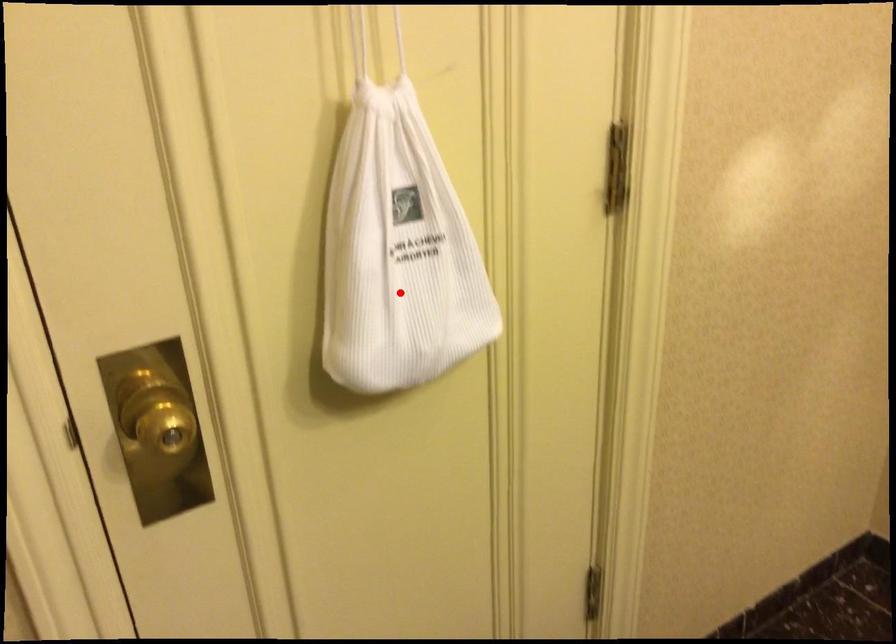
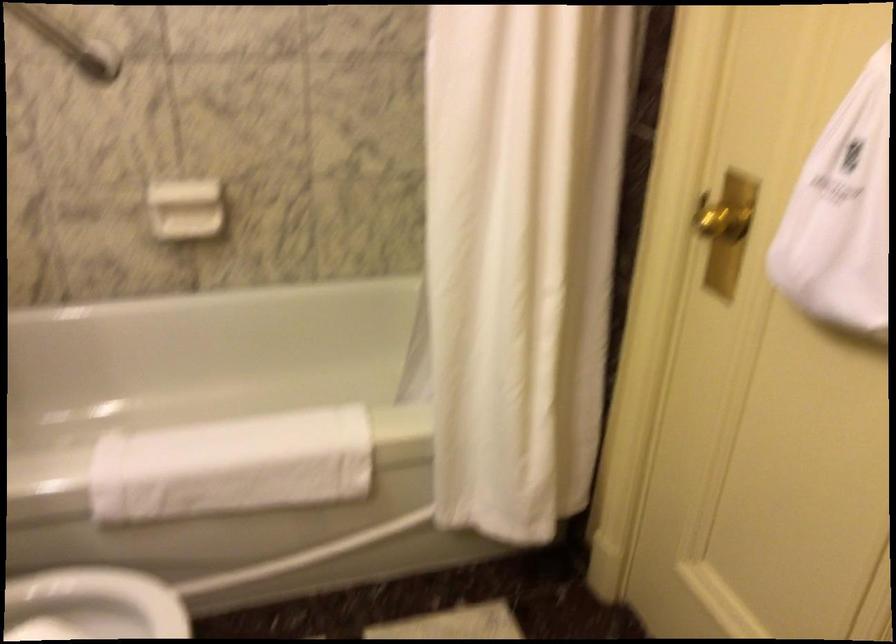
Find the pixel in the second image that matches the highlighted location in the first image.

(841, 214)